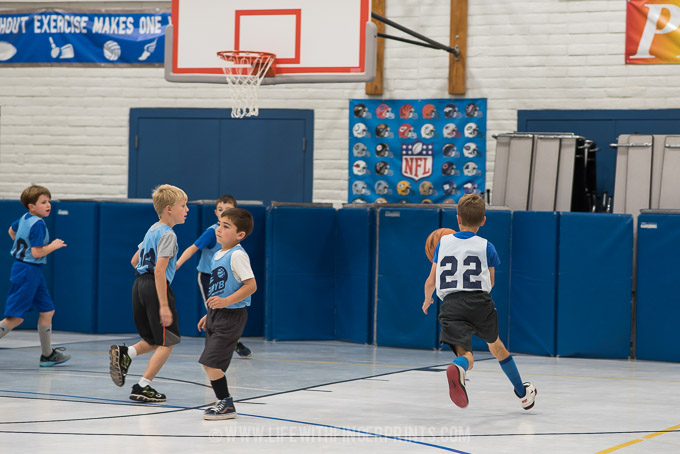
Image resolution: width=680 pixels, height=454 pixels. Identify the location of wall. (86, 126).